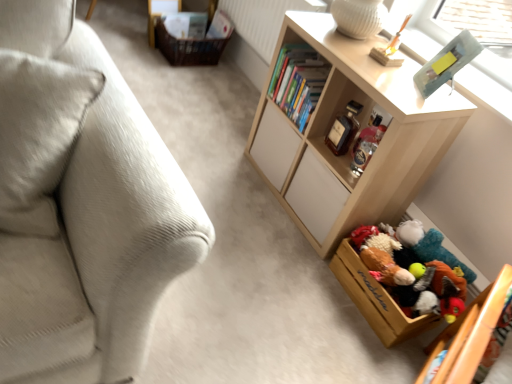
Question: Is the depth of brown woven basket at upper left, the 2th storage box positioned from the front, less than that of light wood shelf at center?

Choices:
 (A) no
 (B) yes

Answer: (A)

Question: Is brown woven basket at upper left, the 1th storage box when ordered from top to bottom, turned away from light wood shelf at center?

Choices:
 (A) no
 (B) yes

Answer: (A)

Question: From a real-world perspective, is brown woven basket at upper left, the second storage box from the right, on light wood shelf at center?

Choices:
 (A) yes
 (B) no

Answer: (B)

Question: Is brown woven basket at upper left, the second storage box from the right, positioned beyond the bounds of light wood shelf at center?

Choices:
 (A) yes
 (B) no

Answer: (A)

Question: Does brown woven basket at upper left, the first storage box in the left-to-right sequence, appear on the right side of light wood shelf at center?

Choices:
 (A) yes
 (B) no

Answer: (B)

Question: Would you say white textured radiator at upper center is inside or outside metallic gray frame at upper right?

Choices:
 (A) outside
 (B) inside

Answer: (A)

Question: Is point [x=271, y=6] closer or farther from the camera than point [x=487, y=59]?

Choices:
 (A) farther
 (B) closer

Answer: (A)

Question: From the image's perspective, is white textured radiator at upper center located above or below metallic gray frame at upper right?

Choices:
 (A) below
 (B) above

Answer: (B)

Question: From a real-world perspective, is white textured radiator at upper center positioned above or below metallic gray frame at upper right?

Choices:
 (A) below
 (B) above

Answer: (A)

Question: Visually, is brown woven basket at upper left, the 1th storage box from the back, positioned to the left or to the right of white textured radiator at upper center?

Choices:
 (A) left
 (B) right

Answer: (A)

Question: Would you say brown woven basket at upper left, the 1th storage box from the back, is inside or outside white textured radiator at upper center?

Choices:
 (A) inside
 (B) outside

Answer: (B)

Question: From the image's perspective, relative to white textured radiator at upper center, is brown woven basket at upper left, the 2th storage box positioned from the front, above or below?

Choices:
 (A) below
 (B) above

Answer: (A)

Question: Is point (166, 33) positioned closer to the camera than point (248, 33)?

Choices:
 (A) farther
 (B) closer

Answer: (B)

Question: In terms of width, does light wood shelf at center look wider or thinner when compared to wooden toy box at lower right, placed as the 2th storage box when sorted from left to right?

Choices:
 (A) thin
 (B) wide

Answer: (A)

Question: Is light wood shelf at center in front of or behind wooden toy box at lower right, arranged as the 2th storage box when viewed from the back, in the image?

Choices:
 (A) behind
 (B) front

Answer: (B)